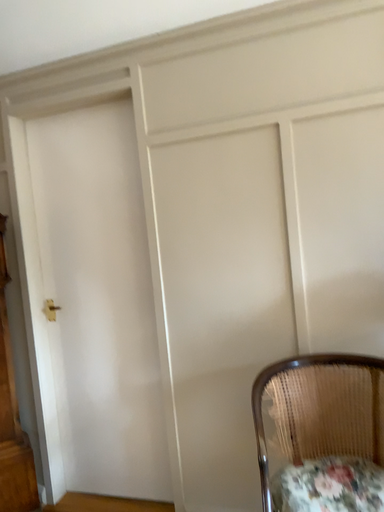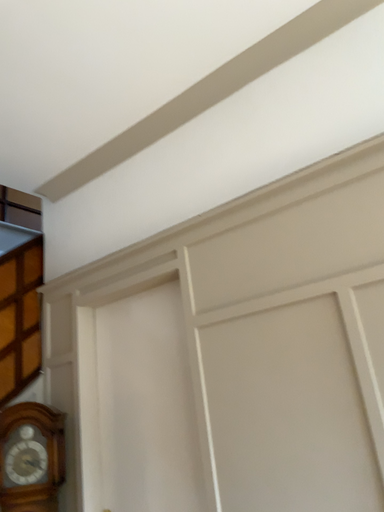
Question: How did the camera likely rotate when shooting the video?

Choices:
 (A) rotated upward
 (B) rotated downward

Answer: (A)